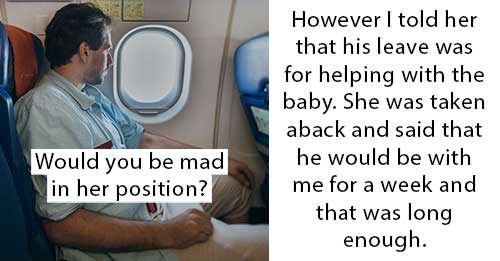
This screenshot has height=261, width=500. I want to click on window, so click(152, 54).